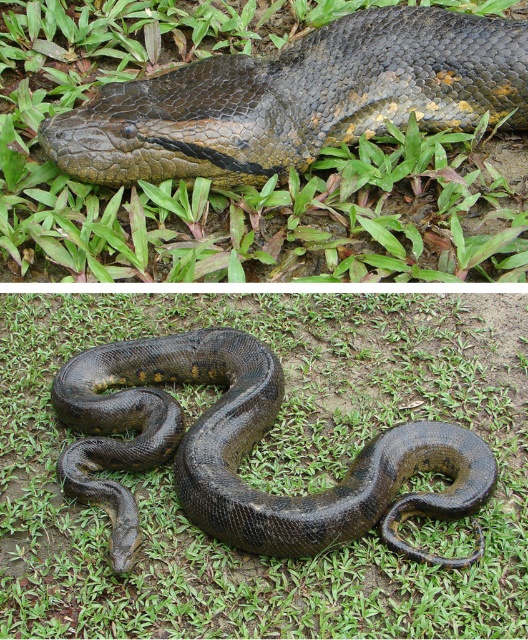
You are a researcher studying snakes in their natural habitat. You are looking at the top image of the two stacked photos. There is a point marked at coordinates (296, 99). What object is located at that point?

The point at coordinates (296, 99) corresponds to the shiny dark green snake at upper center.

In the scene shown: You are a wildlife photographer who wants to capture the snake in the lower image. Based on the provided scene, which snake is wider between the shiny dark green snake at upper center and the shiny dark green snake at center?

The shiny dark green snake at upper center is wider than the shiny dark green snake at center.